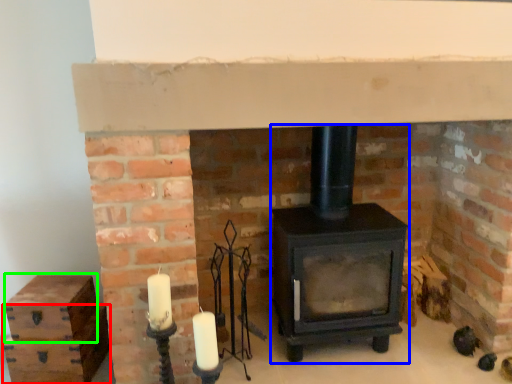
Question: Estimate the real-world distances between objects in this image. Which object is farther from drawer (highlighted by a red box), wood burning stove (highlighted by a blue box) or drawer (highlighted by a green box)?

Choices:
 (A) wood burning stove
 (B) drawer

Answer: (A)